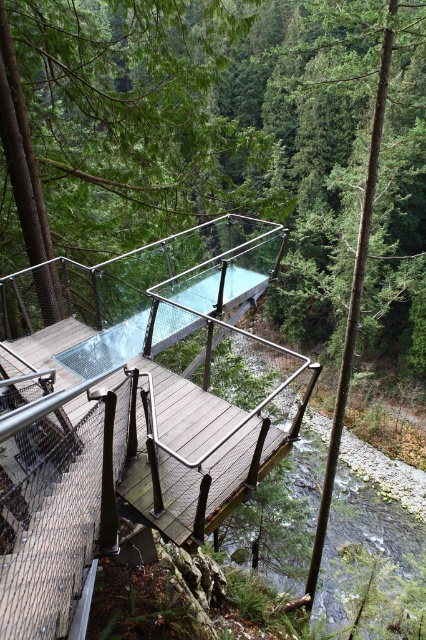
Question: Can you confirm if wooden bridge at center is bigger than transparent glass pool at center?

Choices:
 (A) yes
 (B) no

Answer: (A)

Question: Is wooden bridge at center wider than green matte glass at upper center?

Choices:
 (A) yes
 (B) no

Answer: (B)

Question: Can you confirm if wooden bridge at center is bigger than transparent glass pool at center?

Choices:
 (A) yes
 (B) no

Answer: (A)

Question: Which object is the closest to the transparent glass pool at center?

Choices:
 (A) wooden bridge at center
 (B) green matte glass at upper center

Answer: (A)

Question: Which object appears farthest from the camera in this image?

Choices:
 (A) green matte glass at upper center
 (B) transparent glass pool at center

Answer: (B)

Question: Which object is the farthest from the green matte glass at upper center?

Choices:
 (A) transparent glass pool at center
 (B) wooden bridge at center

Answer: (A)